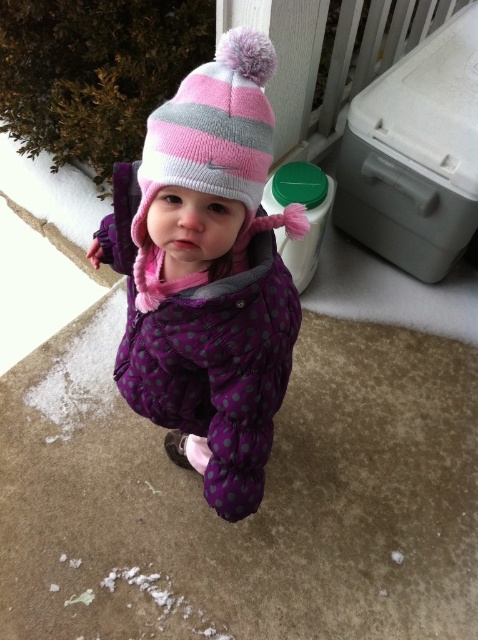
You are a fashion designer who wants to place a new accessory on the purple quilted jacket at center. According to the coordinates, where exactly should you place it?

The purple quilted jacket at center is located at point (208, 356), so you should place the accessory at that coordinate.

Where is the purple quilted jacket at center located in the image?

The purple quilted jacket at center is located at point (x=208, y=356) in the image.